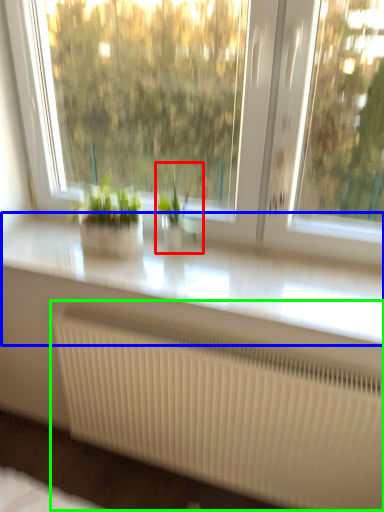
Question: Estimate the real-world distances between objects in this image. Which object is farther from houseplant (highlighted by a red box), counter top (highlighted by a blue box) or radiator (highlighted by a green box)?

Choices:
 (A) counter top
 (B) radiator

Answer: (B)